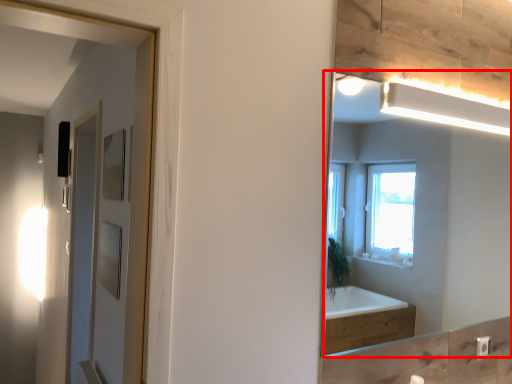
Question: From the image's perspective, what is the correct spatial positioning of mirror (annotated by the red box) in reference to screen door?

Choices:
 (A) below
 (B) above

Answer: (B)